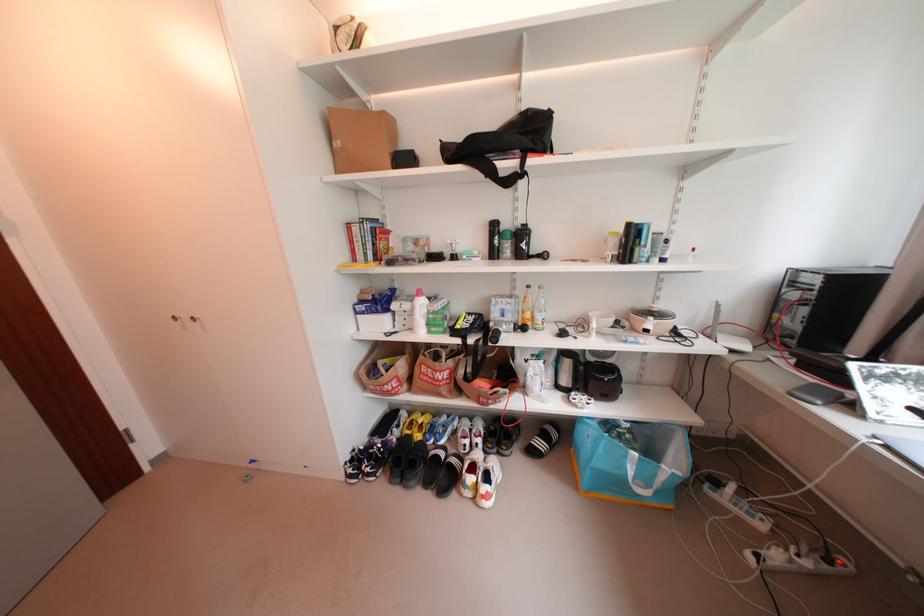
Identify the location of black kettle handle. click(x=582, y=369).